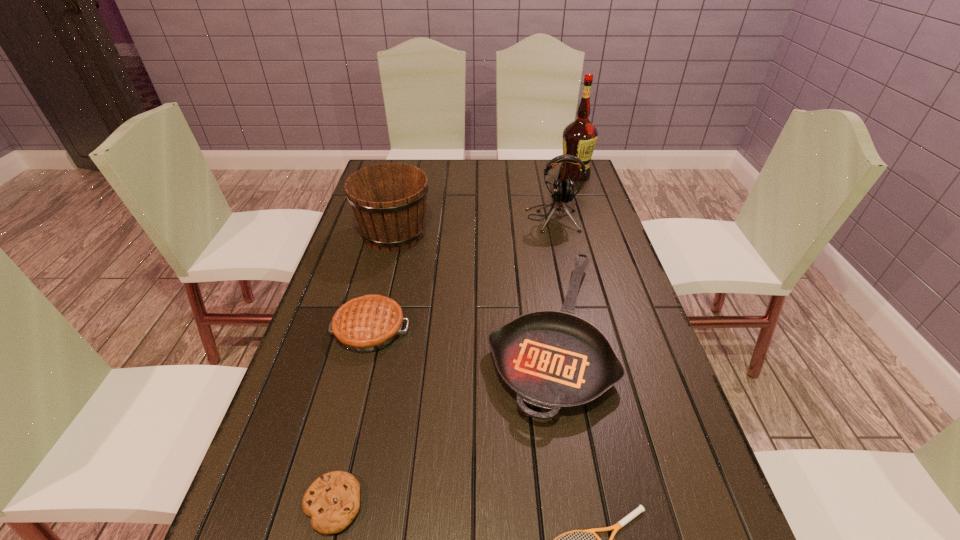
Find the location of a particular element. This screenshot has width=960, height=540. free spot between the second shortest object and the fifth shortest object is located at coordinates pyautogui.click(x=364, y=369).

The height and width of the screenshot is (540, 960). I want to click on the closest object to the wine bucket, so click(x=554, y=360).

The image size is (960, 540). What are the coordinates of `the second closest object to the wine bucket` in the screenshot? It's located at (368, 323).